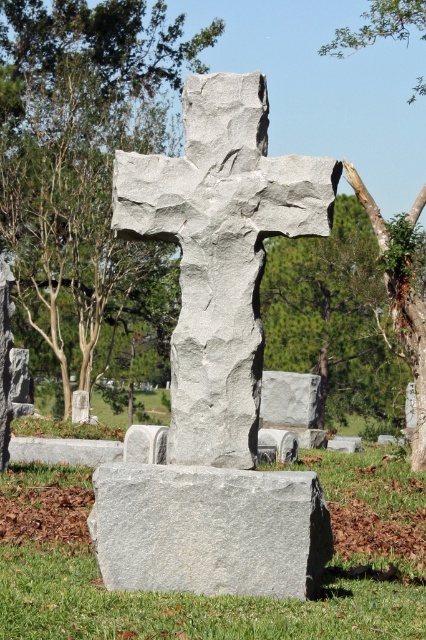
You are a visitor at the cemetery and want to take a photo of the gray stone cross at center and the brown bark tree trunk at right. Which object should you focus on first if you want both to be in the frame without moving the camera?

The gray stone cross at center is located below the brown bark tree trunk at right, so you should focus on the brown bark tree trunk at right first to ensure both are in the frame without moving the camera.

You are standing in the cemetery and want to take a photo of the gray stone slab at center without the brown bark tree trunk at right blocking it. What should you do?

Move to the left side of the gray stone slab at center so that the brown bark tree trunk at right is no longer blocking the view. Since the gray stone slab at center is positioned under the brown bark tree trunk at right, moving to the left would shift the angle away from the tree trunk.